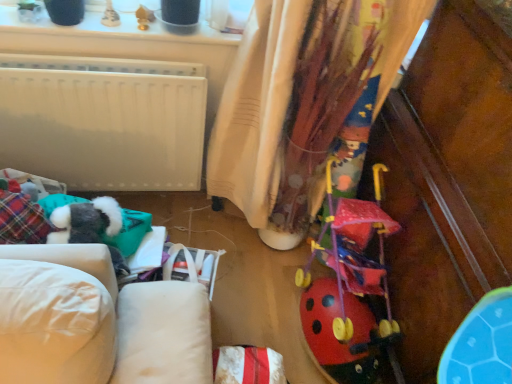
This screenshot has height=384, width=512. Describe the element at coordinates (298, 94) in the screenshot. I see `textured beige curtain at center` at that location.

At what (x,y) coordinates should I click in order to perform the action: click on textured beige curtain at center. Please return your answer as a coordinate pair (x, y). Looking at the image, I should click on (298, 94).

Measure the distance between textured beige curtain at center and camera.

A distance of 4.26 feet exists between textured beige curtain at center and camera.

The height and width of the screenshot is (384, 512). What do you see at coordinates (349, 286) in the screenshot? I see `rubberized red stroller at center-right` at bounding box center [349, 286].

Where is `rubberized red stroller at center-right`? rubberized red stroller at center-right is located at coordinates (349, 286).

Locate an element on the screen. The image size is (512, 384). textured beige curtain at center is located at coordinates (298, 94).

Visually, is textured beige curtain at center positioned to the left or to the right of rubberized red stroller at center-right?

Clearly, textured beige curtain at center is on the left of rubberized red stroller at center-right in the image.

Is the position of textured beige curtain at center more distant than that of rubberized red stroller at center-right?

No, it is in front of rubberized red stroller at center-right.

Is point (241, 154) less distant than point (328, 333)?

No, it is not.

From the image's perspective, which one is positioned lower, textured beige curtain at center or rubberized red stroller at center-right?

rubberized red stroller at center-right, from the image's perspective.

From a real-world perspective, between textured beige curtain at center and rubberized red stroller at center-right, who is vertically higher?

In real-world perspective, textured beige curtain at center is above.

Is textured beige curtain at center wider than rubberized red stroller at center-right?

Incorrect, the width of textured beige curtain at center does not surpass that of rubberized red stroller at center-right.

From their relative heights in the image, would you say textured beige curtain at center is taller or shorter than rubberized red stroller at center-right?

Clearly, textured beige curtain at center is taller compared to rubberized red stroller at center-right.

Is textured beige curtain at center bigger than rubberized red stroller at center-right?

Yes, textured beige curtain at center is bigger than rubberized red stroller at center-right.

From the picture: Could rubberized red stroller at center-right be considered to be inside textured beige curtain at center?

No, rubberized red stroller at center-right is located outside of textured beige curtain at center.

Is textured beige curtain at center not near rubberized red stroller at center-right?

No, textured beige curtain at center is not far away from rubberized red stroller at center-right.

Is textured beige curtain at center oriented away from rubberized red stroller at center-right?

textured beige curtain at center does not have its back to rubberized red stroller at center-right.

Can you tell me how much textured beige curtain at center and rubberized red stroller at center-right differ in facing direction?

There is a 90.3-degree angle between the facing directions of textured beige curtain at center and rubberized red stroller at center-right.

Identify the location of curtain located above the rubberized red stroller at center-right (from the image's perspective). (298, 94).

Can you confirm if rubberized red stroller at center-right is positioned to the right of textured beige curtain at center?

Correct, you'll find rubberized red stroller at center-right to the right of textured beige curtain at center.

Relative to textured beige curtain at center, is rubberized red stroller at center-right in front or behind?

rubberized red stroller at center-right is positioned farther from the viewer than textured beige curtain at center.

Does point (335, 316) come farther from viewer compared to point (250, 118)?

No.

From the image's perspective, is rubberized red stroller at center-right above textured beige curtain at center?

Incorrect, from the image's perspective, rubberized red stroller at center-right is lower than textured beige curtain at center.

From a real-world perspective, who is located lower, rubberized red stroller at center-right or textured beige curtain at center?

In real-world perspective, rubberized red stroller at center-right is lower.

Considering the sizes of objects rubberized red stroller at center-right and textured beige curtain at center in the image provided, who is wider, rubberized red stroller at center-right or textured beige curtain at center?

With larger width is rubberized red stroller at center-right.

Considering the sizes of rubberized red stroller at center-right and textured beige curtain at center in the image, is rubberized red stroller at center-right taller or shorter than textured beige curtain at center?

In the image, rubberized red stroller at center-right appears to be shorter than textured beige curtain at center.

Is rubberized red stroller at center-right smaller than textured beige curtain at center?

Correct, rubberized red stroller at center-right occupies less space than textured beige curtain at center.

Can we say rubberized red stroller at center-right lies outside textured beige curtain at center?

rubberized red stroller at center-right lies outside textured beige curtain at center's area.

Is rubberized red stroller at center-right placed right next to textured beige curtain at center?

No, rubberized red stroller at center-right is not in contact with textured beige curtain at center.

Is rubberized red stroller at center-right facing towards textured beige curtain at center?

No, rubberized red stroller at center-right is not facing towards textured beige curtain at center.

At what (x,y) coordinates should I click in order to perform the action: click on curtain above the rubberized red stroller at center-right (from a real-world perspective). Please return your answer as a coordinate pair (x, y). Looking at the image, I should click on (298, 94).

Locate an element on the screen. The width and height of the screenshot is (512, 384). toy that appears below the textured beige curtain at center (from the image's perspective) is located at coordinates (349, 286).

What are the coordinates of `curtain in front of the rubberized red stroller at center-right` in the screenshot? It's located at (298, 94).